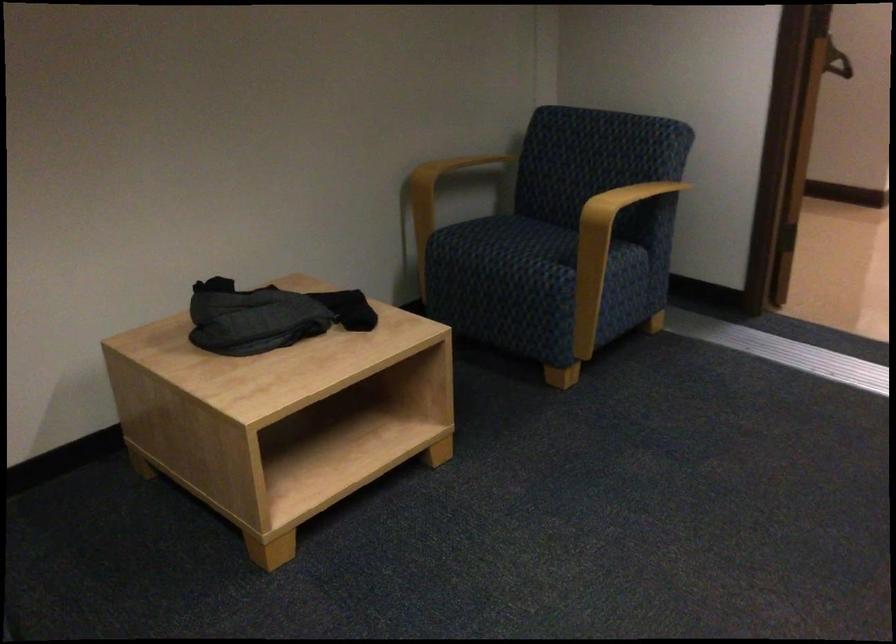
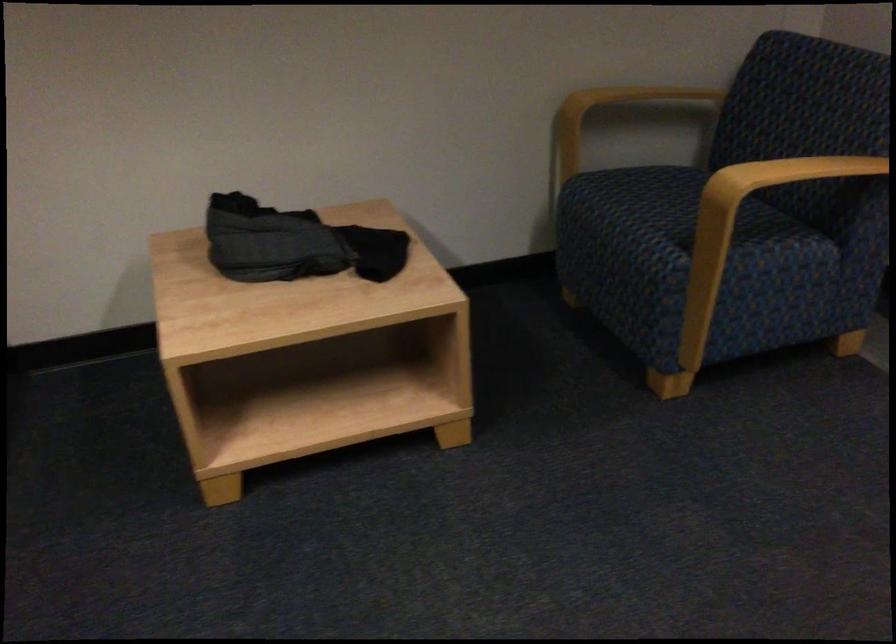
Locate, in the second image, the point that corresponds to the point at 437,182 in the first image.

(608, 113)